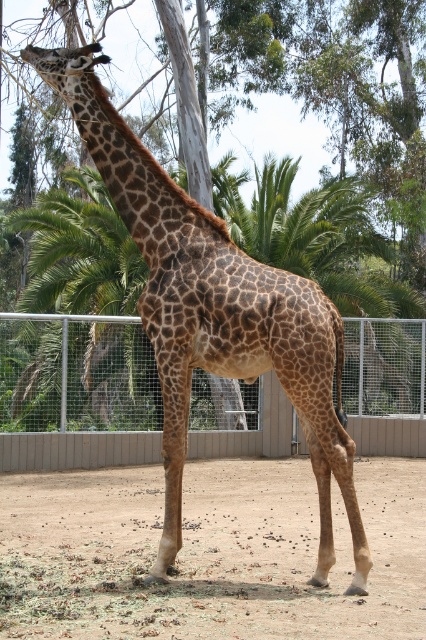
Question: Is brown sandy dirt at center positioned before brown spotted giraffe at center?

Choices:
 (A) yes
 (B) no

Answer: (B)

Question: Which object appears farthest from the camera in this image?

Choices:
 (A) brown spotted giraffe at center
 (B) metal wire fence at center

Answer: (B)

Question: Can you confirm if brown sandy dirt at center is positioned to the left of metal wire fence at center?

Choices:
 (A) yes
 (B) no

Answer: (B)

Question: Which point is farther to the camera?

Choices:
 (A) brown spotted giraffe at center
 (B) brown sandy dirt at center
 (C) metal wire fence at center

Answer: (C)

Question: Among these points, which one is farthest from the camera?

Choices:
 (A) tap(166, 452)
 (B) tap(63, 528)

Answer: (B)

Question: Is brown spotted giraffe at center smaller than metal wire fence at center?

Choices:
 (A) no
 (B) yes

Answer: (B)